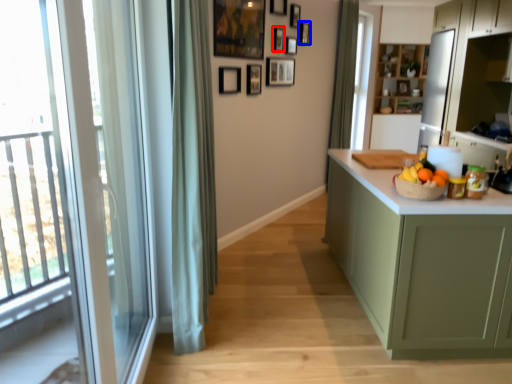
Question: Which point is closer to the camera, picture frame (highlighted by a red box) or picture frame (highlighted by a blue box)?

Choices:
 (A) picture frame
 (B) picture frame

Answer: (A)